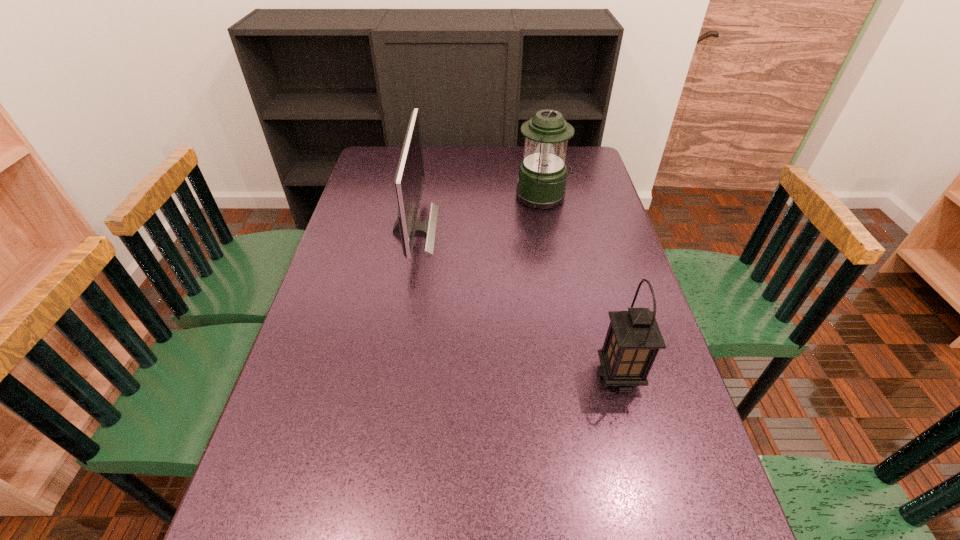
Find the location of `vacant region between the nearer lantern and the farther lantern`. vacant region between the nearer lantern and the farther lantern is located at coordinates (581, 286).

You are a GUI agent. You are given a task and a screenshot of the screen. Output one action in this format:
    pyautogui.click(x=<x>, y=<y>)
    Task: Click on the vacant space that is in between the monitor and the nearest object
    
    Given the screenshot: What is the action you would take?
    pyautogui.click(x=516, y=302)

Find the location of a particular element. free point between the nearer lantern and the farther lantern is located at coordinates (581, 286).

Image resolution: width=960 pixels, height=540 pixels. I want to click on blank region between the nearest object and the farther lantern, so click(x=581, y=286).

This screenshot has height=540, width=960. Identify the location of blank region between the farther lantern and the nearer lantern. (581, 286).

The width and height of the screenshot is (960, 540). I want to click on vacant space in between the leftmost object and the farther lantern, so click(x=479, y=213).

At what (x,y) coordinates should I click in order to perform the action: click on vacant region between the leftmost object and the farther lantern. Please return your answer as a coordinate pair (x, y). Looking at the image, I should click on (479, 213).

Identify the location of free spot between the monitor and the farther lantern. (479, 213).

Locate an element on the screen. The image size is (960, 540). free area in between the nearest object and the farther lantern is located at coordinates (581, 286).

Find the location of `free space between the farther lantern and the nearer lantern`. free space between the farther lantern and the nearer lantern is located at coordinates (581, 286).